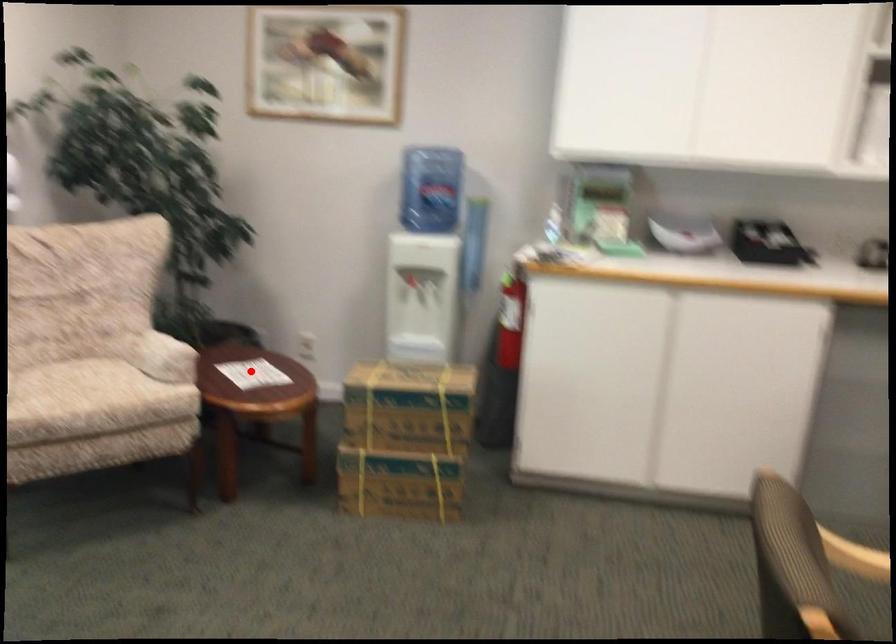
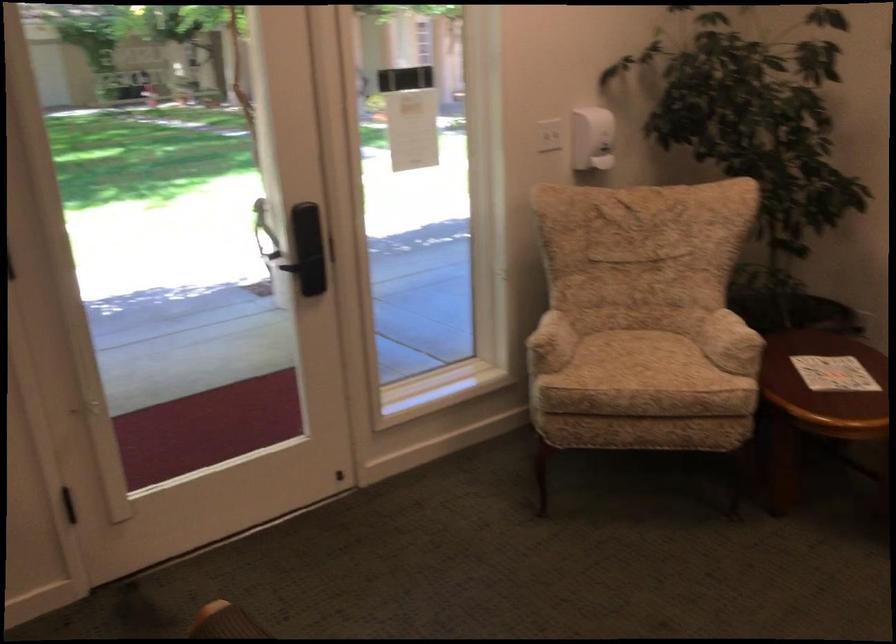
Question: I am providing you with two images of the same scene from different viewpoints. A red point is shown in image1. For the corresponding object point in image2, is it positioned nearer or farther from the camera?

Choices:
 (A) Nearer
 (B) Farther

Answer: (A)